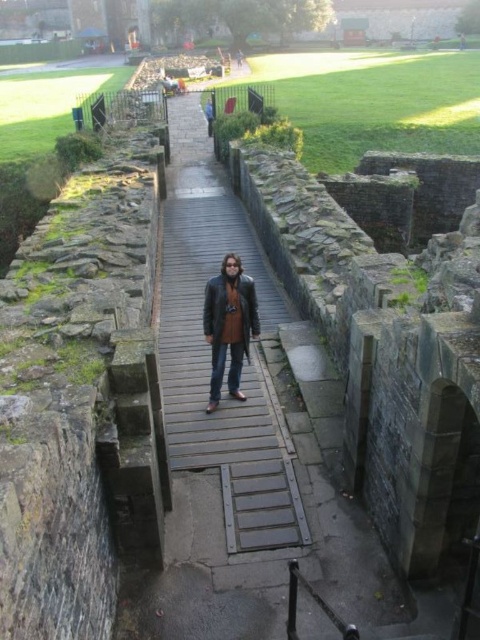
Can you confirm if wooden bridge at center is positioned below brown leather jacket at center?

No, wooden bridge at center is not below brown leather jacket at center.

In the scene shown: Is wooden bridge at center wider than brown leather jacket at center?

Yes.

The width and height of the screenshot is (480, 640). What do you see at coordinates (228, 349) in the screenshot?
I see `wooden bridge at center` at bounding box center [228, 349].

Find the location of a particular element. The height and width of the screenshot is (640, 480). wooden bridge at center is located at coordinates (228, 349).